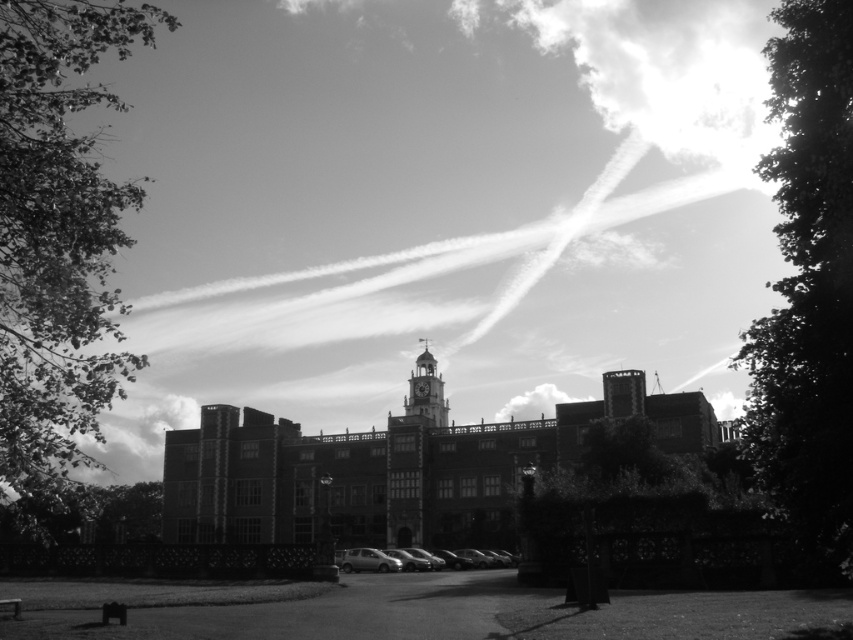
Does green leafy tree at left have a lesser height compared to silhouette leafy tree at right?

Incorrect, green leafy tree at left's height does not fall short of silhouette leafy tree at right's.

Between green leafy tree at left and silhouette leafy tree at right, which one appears on the left side from the viewer's perspective?

Positioned to the left is green leafy tree at left.

The width and height of the screenshot is (853, 640). What do you see at coordinates (57, 250) in the screenshot?
I see `green leafy tree at left` at bounding box center [57, 250].

Locate an element on the screen. green leafy tree at left is located at coordinates (57, 250).

Can you confirm if smooth stone clock tower at center is bigger than metallic silver car at center?

Yes.

Does point (430, 362) come farther from viewer compared to point (387, 568)?

Yes, point (430, 362) is behind point (387, 568).

Measure the distance between point (426, 340) and camera.

Point (426, 340) is 150.21 meters away from camera.

Find the location of a particular element. This screenshot has width=853, height=640. smooth stone clock tower at center is located at coordinates click(426, 392).

Is dark green leafy tree at center to the left of metallic silver car at center from the viewer's perspective?

No, dark green leafy tree at center is not to the left of metallic silver car at center.

Which is more to the left, dark green leafy tree at center or metallic silver car at center?

metallic silver car at center is more to the left.

This screenshot has width=853, height=640. Identify the location of dark green leafy tree at center. (643, 515).